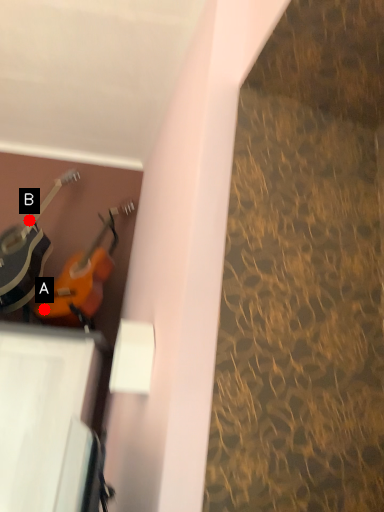
Question: Two points are circled on the image, labeled by A and B beside each circle. Which point is farther to the camera?

Choices:
 (A) A is further
 (B) B is further

Answer: (B)